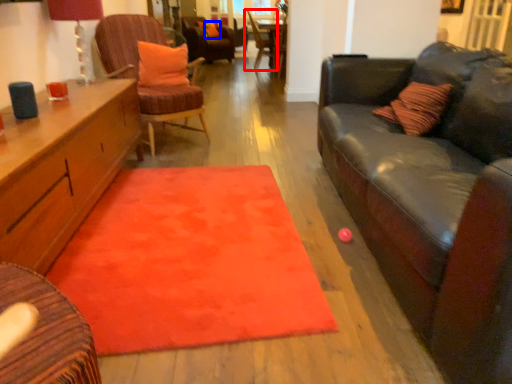
Question: Among these objects, which one is nearest to the camera, chair (highlighted by a red box) or pillow (highlighted by a blue box)?

Choices:
 (A) chair
 (B) pillow

Answer: (A)